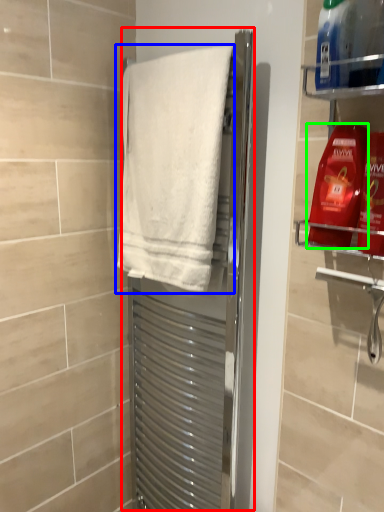
Question: Which object is the closest to the screen door (highlighted by a red box)? Choose among these: towel (highlighted by a blue box) or cleaning product (highlighted by a green box).

Choices:
 (A) towel
 (B) cleaning product

Answer: (A)